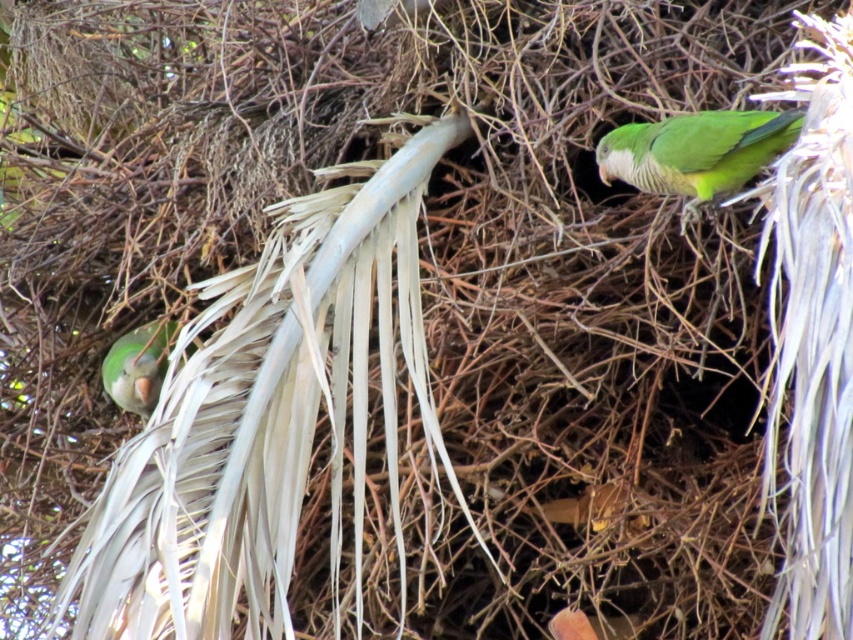
Describe the element at coordinates (695, 152) in the screenshot. I see `green matte parrot at upper right` at that location.

Who is higher up, green matte parrot at upper right or matte green parrot at left?

green matte parrot at upper right is higher up.

Locate an element on the screen. The image size is (853, 640). green matte parrot at upper right is located at coordinates (695, 152).